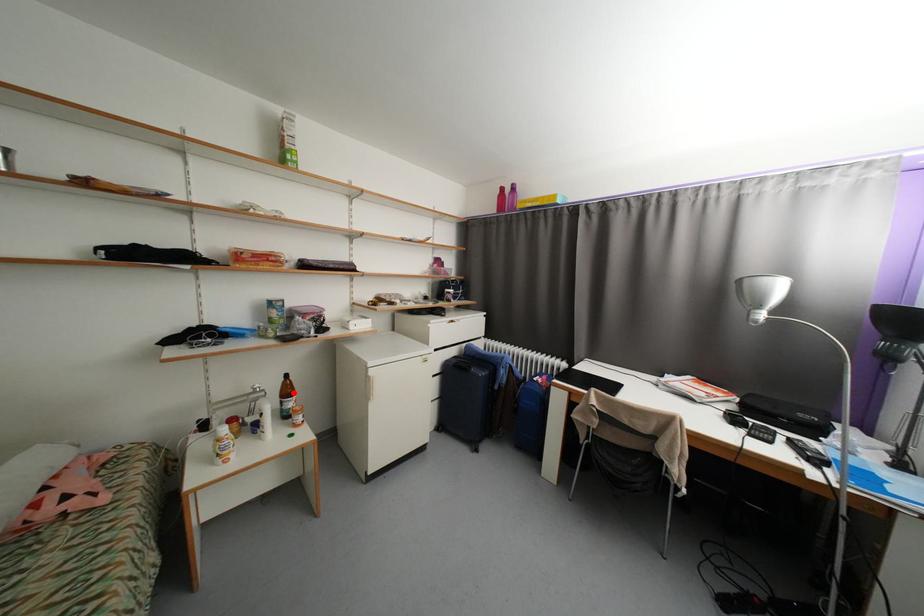
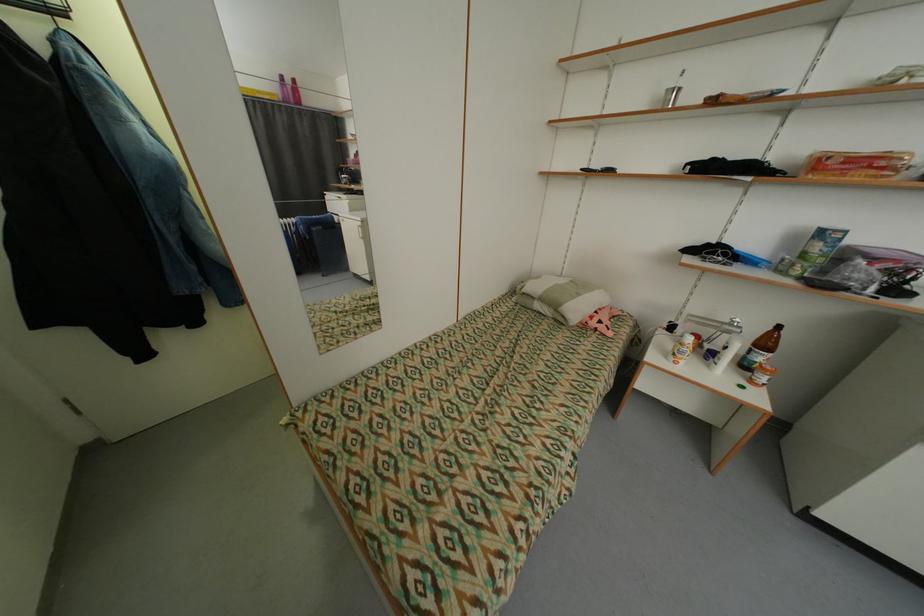
Question: I am providing you with two images of the same scene from different viewpoints. A red point is shown in image1. For the corresponding object point in image2, is it positioned nearer or farther from the camera?

Choices:
 (A) Nearer
 (B) Farther

Answer: (B)